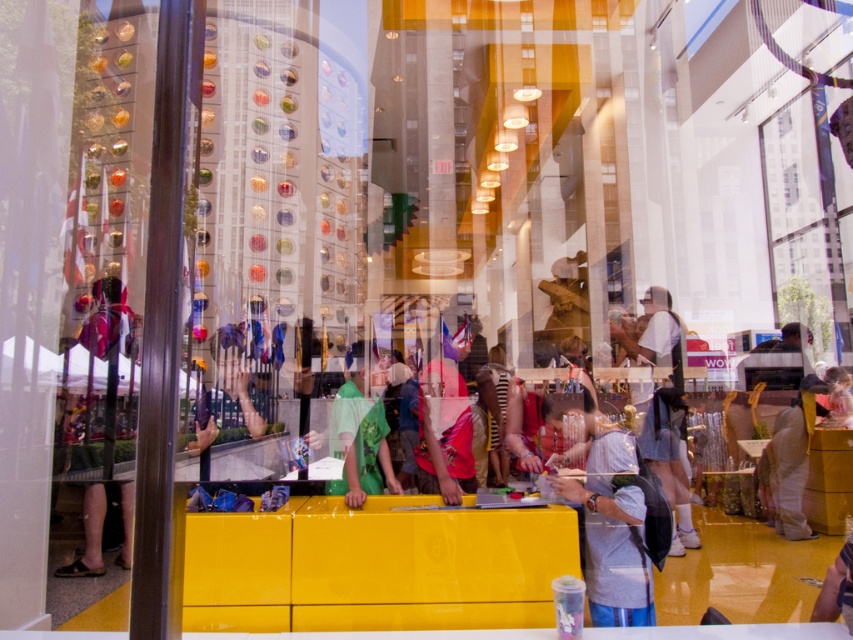
Question: Does light brown fabric pants at center have a greater width compared to denim jacket at lower right?

Choices:
 (A) no
 (B) yes

Answer: (B)

Question: Does light brown fabric pants at center appear under denim jacket at lower right?

Choices:
 (A) no
 (B) yes

Answer: (B)

Question: Estimate the real-world distances between objects in this image. Which object is closer to the light brown fabric pants at center?

Choices:
 (A) green matte shirt at center
 (B) denim jacket at lower right

Answer: (B)

Question: Which of these objects is positioned farthest from the matte gray backpack at lower right?

Choices:
 (A) green matte shirt at center
 (B) light brown fabric pants at center
 (C) denim jacket at lower right

Answer: (B)

Question: Can you confirm if green matte shirt at center is thinner than denim jacket at lower right?

Choices:
 (A) no
 (B) yes

Answer: (B)

Question: Among these objects, which one is nearest to the camera?

Choices:
 (A) green matte shirt at center
 (B) denim jacket at lower right

Answer: (A)